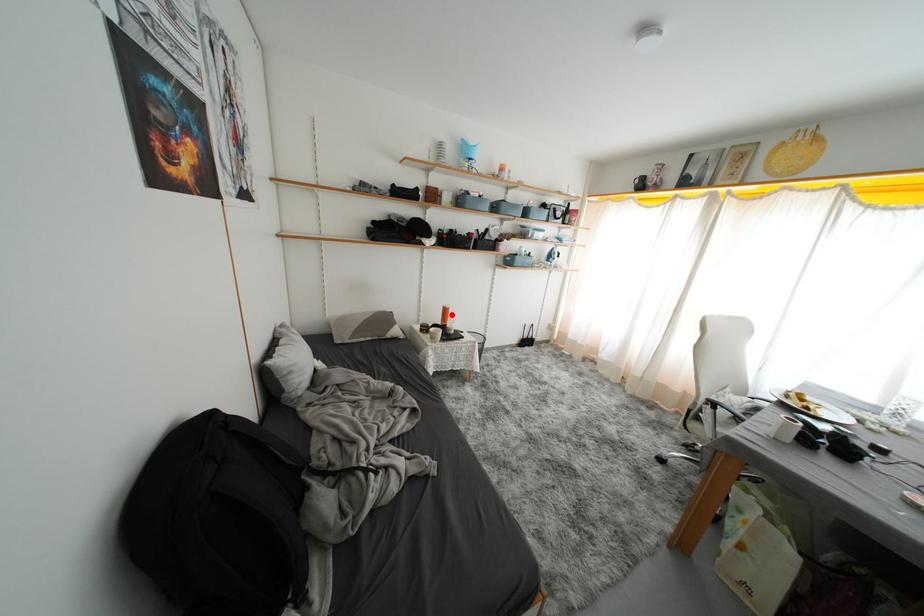
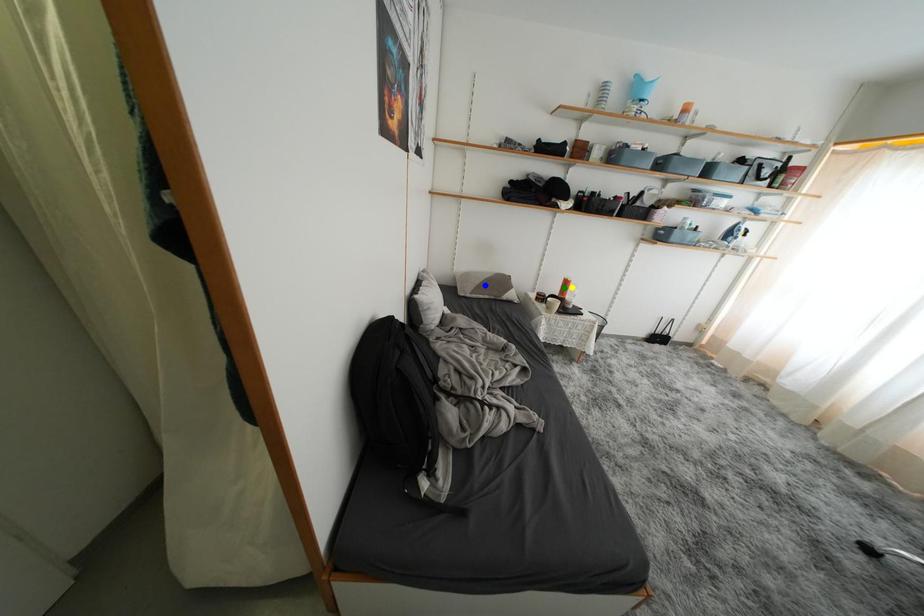
Question: I am providing you with two images of the same scene from different viewpoints. A red point is marked on the first image. You are given multiple points on the second image. Which spot in image 2 lines up with the point in image 1?

Choices:
 (A) green point
 (B) blue point
 (C) yellow point

Answer: (C)